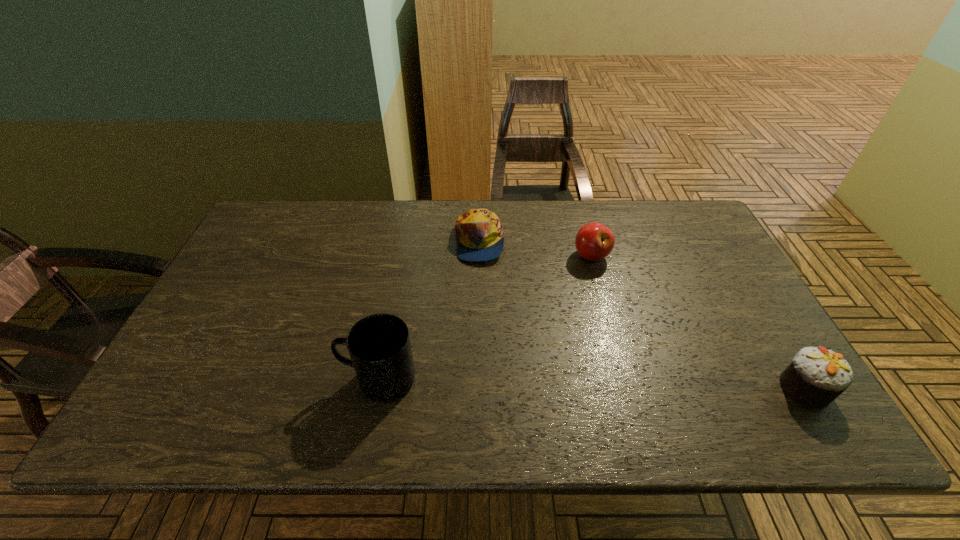
The height and width of the screenshot is (540, 960). Identify the location of mug. (379, 345).

The width and height of the screenshot is (960, 540). I want to click on the leftmost object, so click(x=379, y=345).

What are the coordinates of `cupcake` in the screenshot? It's located at (816, 377).

Find the location of a particular element. The width and height of the screenshot is (960, 540). the shortest object is located at coordinates (480, 234).

Identify the location of the second object from left to right. The image size is (960, 540). (480, 234).

Identify the location of the third object from left to right. (594, 241).

Where is `free region located 0.070m on the side of the leftmost object with the handle`? The image size is (960, 540). free region located 0.070m on the side of the leftmost object with the handle is located at coordinates (312, 379).

What are the coordinates of `vacant space located 0.390m on the side of the leftmost object with the handle` in the screenshot? It's located at (174, 379).

This screenshot has width=960, height=540. Find the location of `vacant space located 0.180m on the side of the leftmost object with the handle`. vacant space located 0.180m on the side of the leftmost object with the handle is located at coordinates (265, 379).

This screenshot has width=960, height=540. Identify the location of free region located 0.170m on the back of the cupcake. click(759, 314).